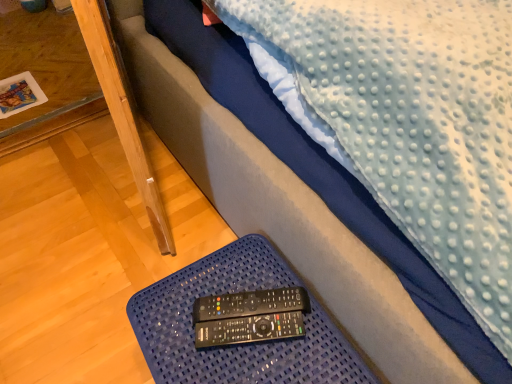
Find the location of a particular element. The width and height of the screenshot is (512, 384). spots to the right of black plastic remote at lower center, the 2th control when ordered from back to front is located at coordinates (321, 345).